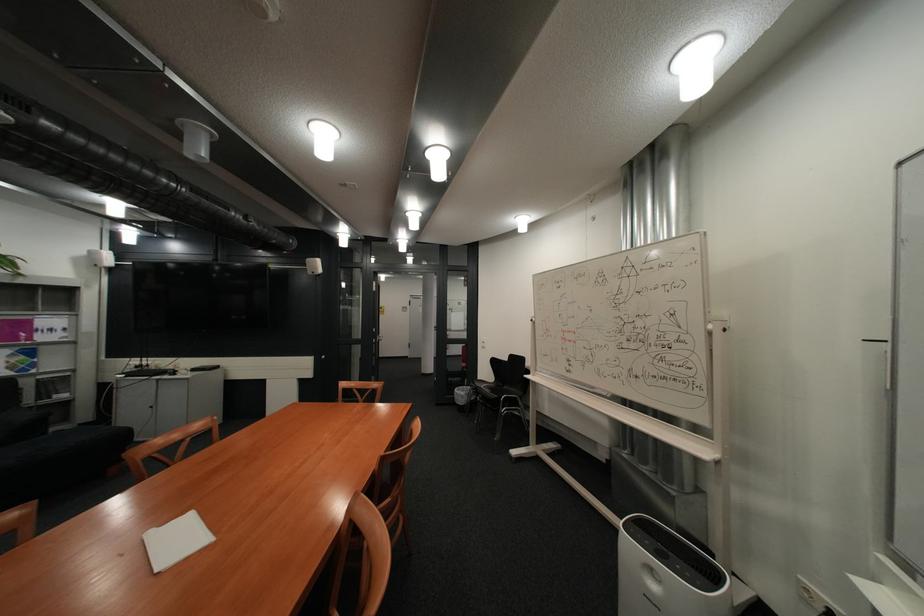
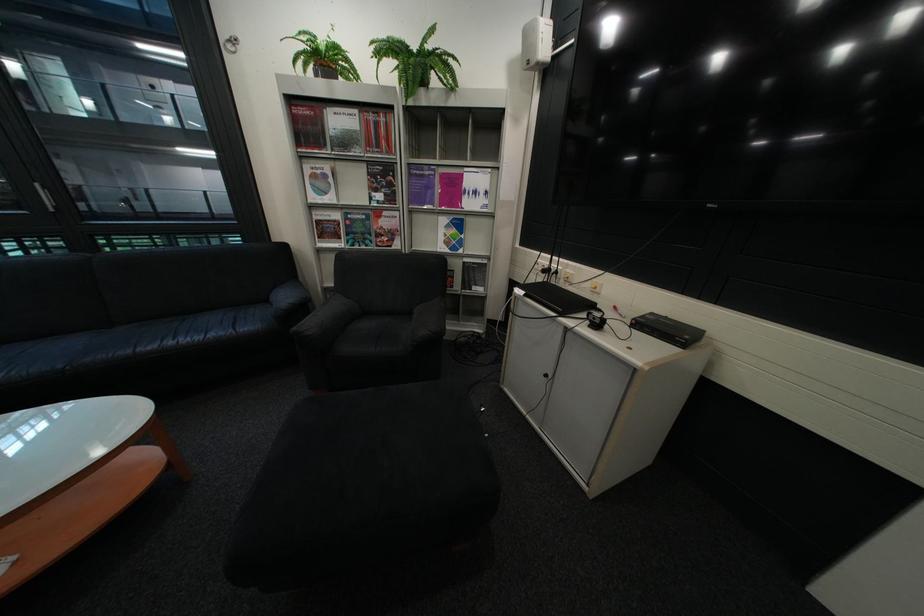
Where in the second image is the point corresponding to the point at 154,367 from the first image?

(563, 270)